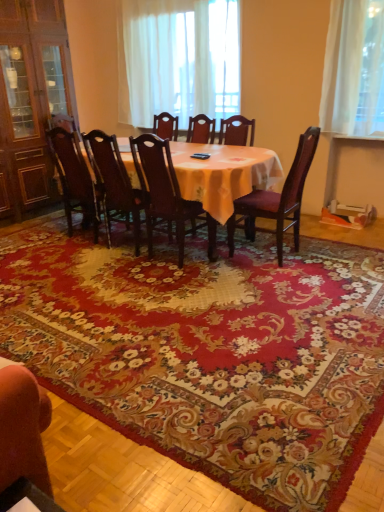
Question: Does wooden chair at center, arranged as the second chair when viewed from the right, have a smaller size compared to dark brown wood chair at center, which ranks as the 1th chair in left-to-right order?

Choices:
 (A) no
 (B) yes

Answer: (A)

Question: Would you say wooden chair at center, the fourth chair from the left, contains dark brown wood chair at center, which ranks as the 1th chair in left-to-right order?

Choices:
 (A) no
 (B) yes

Answer: (A)

Question: Is wooden chair at center, arranged as the second chair when viewed from the right, completely or partially outside of dark brown wood chair at center, the fifth chair positioned from the right?

Choices:
 (A) yes
 (B) no

Answer: (A)

Question: Can you confirm if wooden chair at center, arranged as the second chair when viewed from the right, is wider than dark brown wood chair at center, the fifth chair positioned from the right?

Choices:
 (A) yes
 (B) no

Answer: (A)

Question: Is the depth of wooden chair at center, arranged as the second chair when viewed from the right, greater than that of dark brown wood chair at center, which ranks as the 1th chair in left-to-right order?

Choices:
 (A) yes
 (B) no

Answer: (B)

Question: Does wooden chair at center, arranged as the second chair when viewed from the right, appear on the left side of dark brown wood chair at center, the fifth chair positioned from the right?

Choices:
 (A) yes
 (B) no

Answer: (B)

Question: Considering the relative positions of white sheer curtain at upper center and wooden chair with purple cushion at right, placed as the 1th chair when sorted from right to left, in the image provided, is white sheer curtain at upper center to the right of wooden chair with purple cushion at right, placed as the 1th chair when sorted from right to left, from the viewer's perspective?

Choices:
 (A) no
 (B) yes

Answer: (A)

Question: Can you confirm if white sheer curtain at upper center is thinner than wooden chair with purple cushion at right, placed as the 1th chair when sorted from right to left?

Choices:
 (A) no
 (B) yes

Answer: (B)

Question: Can you confirm if white sheer curtain at upper center is bigger than wooden chair with purple cushion at right, placed as the 1th chair when sorted from right to left?

Choices:
 (A) no
 (B) yes

Answer: (B)

Question: From a real-world perspective, is white sheer curtain at upper center positioned under wooden chair with purple cushion at right, placed as the 1th chair when sorted from right to left, based on gravity?

Choices:
 (A) yes
 (B) no

Answer: (B)

Question: Can you confirm if white sheer curtain at upper center is positioned to the left of wooden chair with purple cushion at right, the fifth chair when ordered from left to right?

Choices:
 (A) no
 (B) yes

Answer: (B)

Question: Does white sheer curtain at upper center have a lesser height compared to wooden chair with purple cushion at right, the fifth chair when ordered from left to right?

Choices:
 (A) yes
 (B) no

Answer: (B)

Question: Does wooden chair at center, arranged as the second chair when viewed from the right, appear on the left side of white sheer curtain at upper center?

Choices:
 (A) no
 (B) yes

Answer: (A)